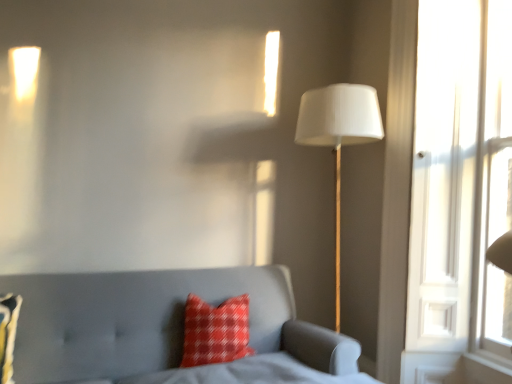
In order to click on red plaid pillow at center, the 1th pillow from the right in this screenshot , I will do `click(215, 331)`.

Locate an element on the screen. This screenshot has height=384, width=512. pillow on the right side of red plaid pillow at lower left, which is counted as the 2th pillow, starting from the back is located at coordinates (215, 331).

Between point (236, 336) and point (9, 352), which one is positioned behind?

The point (236, 336) is farther.

Is red plaid pillow at lower left, placed as the 1th pillow when sorted from front to back, a part of red plaid pillow at center, the 1th pillow when ordered from back to front?

No.

From the image's perspective, which is above, red plaid pillow at center, the second pillow from the front, or red plaid pillow at lower left, which is counted as the 2th pillow, starting from the back?

red plaid pillow at lower left, which is counted as the 2th pillow, starting from the back, appears higher in the image.

Looking at this image, does white fabric lampshade at right appear on the right side of red plaid pillow at lower left, which is the 2th pillow in right-to-left order?

Indeed, white fabric lampshade at right is positioned on the right side of red plaid pillow at lower left, which is the 2th pillow in right-to-left order.

From a real-world perspective, is white fabric lampshade at right physically above red plaid pillow at lower left, which is the 2th pillow in right-to-left order?

Yes, from a real-world perspective, white fabric lampshade at right is above red plaid pillow at lower left, which is the 2th pillow in right-to-left order.

Is white fabric lampshade at right not close to red plaid pillow at lower left, acting as the first pillow starting from the left?

Absolutely, white fabric lampshade at right is distant from red plaid pillow at lower left, acting as the first pillow starting from the left.

From the image's perspective, is white fabric lampshade at right on top of red plaid pillow at lower left, which is the 2th pillow in right-to-left order?

Yes, from the image's perspective, white fabric lampshade at right is on top of red plaid pillow at lower left, which is the 2th pillow in right-to-left order.

Is red plaid pillow at center, the 1th pillow from the right, to the left or to the right of white fabric lampshade at right in the image?

red plaid pillow at center, the 1th pillow from the right, is positioned on white fabric lampshade at right's left side.

Is red plaid pillow at center, the 1th pillow when ordered from back to front, wider than white fabric lampshade at right?

No.

Is point (189, 363) positioned before point (356, 92)?

Yes, point (189, 363) is closer to viewer.

Does red plaid pillow at center, the 1th pillow when ordered from back to front, have a greater height compared to white fabric lampshade at right?

No.

Who is bigger, white fabric lampshade at right or matte gray sofa at lower left?

With larger size is matte gray sofa at lower left.

From the image's perspective, between white fabric lampshade at right and matte gray sofa at lower left, which one is located above?

white fabric lampshade at right appears higher in the image.

From a real-world perspective, is white fabric lampshade at right over matte gray sofa at lower left?

Correct, in the physical world, white fabric lampshade at right is higher than matte gray sofa at lower left.

Is red plaid pillow at center, the 1th pillow from the right, taller or shorter than matte gray sofa at lower left?

red plaid pillow at center, the 1th pillow from the right, is shorter than matte gray sofa at lower left.

From the image's perspective, would you say red plaid pillow at center, the 1th pillow from the right, is positioned over matte gray sofa at lower left?

Indeed, from the image's perspective, red plaid pillow at center, the 1th pillow from the right, is shown above matte gray sofa at lower left.

Can you confirm if red plaid pillow at center, the 1th pillow when ordered from back to front, is wider than matte gray sofa at lower left?

No, red plaid pillow at center, the 1th pillow when ordered from back to front, is not wider than matte gray sofa at lower left.

Is red plaid pillow at lower left, placed as the 1th pillow when sorted from front to back, not near matte gray sofa at lower left?

No, red plaid pillow at lower left, placed as the 1th pillow when sorted from front to back, is not far away from matte gray sofa at lower left.

Which object is more forward, red plaid pillow at lower left, acting as the first pillow starting from the left, or matte gray sofa at lower left?

matte gray sofa at lower left is in front.

Which is behind, point (4, 298) or point (59, 381)?

The point (4, 298) is more distant.

Is matte gray sofa at lower left beside red plaid pillow at lower left, acting as the first pillow starting from the left?

No, matte gray sofa at lower left is not making contact with red plaid pillow at lower left, acting as the first pillow starting from the left.

Based on the photo, considering the sizes of objects matte gray sofa at lower left and red plaid pillow at lower left, placed as the 1th pillow when sorted from front to back, in the image provided, who is wider, matte gray sofa at lower left or red plaid pillow at lower left, placed as the 1th pillow when sorted from front to back,?

matte gray sofa at lower left is wider.

Consider the image. Could you tell me if matte gray sofa at lower left is turned towards red plaid pillow at lower left, acting as the first pillow starting from the left?

No, matte gray sofa at lower left is not facing towards red plaid pillow at lower left, acting as the first pillow starting from the left.

Based on their sizes in the image, would you say matte gray sofa at lower left is bigger or smaller than red plaid pillow at lower left, placed as the 1th pillow when sorted from front to back?

matte gray sofa at lower left is bigger than red plaid pillow at lower left, placed as the 1th pillow when sorted from front to back.

Identify the location of pillow above the red plaid pillow at center, the second pillow from the front (from the image's perspective). (8, 334).

Image resolution: width=512 pixels, height=384 pixels. What are the coordinates of `the 2nd pillow below the white fabric lampshade at right (from a real-world perspective)` in the screenshot? It's located at (8, 334).

When comparing their distances from red plaid pillow at lower left, placed as the 1th pillow when sorted from front to back, does matte gray sofa at lower left or red plaid pillow at center, acting as the second pillow starting from the left, seem closer?

The object closer to red plaid pillow at lower left, placed as the 1th pillow when sorted from front to back, is matte gray sofa at lower left.

Considering their positions, is red plaid pillow at center, the 1th pillow from the right, positioned further to matte gray sofa at lower left than white fabric lampshade at right?

white fabric lampshade at right lies further to matte gray sofa at lower left than the other object.

Which object lies nearer to the anchor point red plaid pillow at center, acting as the second pillow starting from the left, red plaid pillow at lower left, acting as the first pillow starting from the left, or matte gray sofa at lower left?

matte gray sofa at lower left is positioned closer to the anchor red plaid pillow at center, acting as the second pillow starting from the left.

Considering their positions, is red plaid pillow at center, acting as the second pillow starting from the left, positioned further to red plaid pillow at lower left, placed as the 1th pillow when sorted from front to back, than white fabric lampshade at right?

white fabric lampshade at right lies further to red plaid pillow at lower left, placed as the 1th pillow when sorted from front to back, than the other object.

Considering their positions, is matte gray sofa at lower left positioned closer to white fabric lampshade at right than red plaid pillow at center, the second pillow from the front?

Among the two, red plaid pillow at center, the second pillow from the front, is located nearer to white fabric lampshade at right.

Looking at the image, which one is located further to white fabric lampshade at right, red plaid pillow at center, the 1th pillow when ordered from back to front, or matte gray sofa at lower left?

Based on the image, matte gray sofa at lower left appears to be further to white fabric lampshade at right.

From the image, which object appears to be nearer to matte gray sofa at lower left, white fabric lampshade at right or red plaid pillow at center, the second pillow from the front?

red plaid pillow at center, the second pillow from the front, is closer to matte gray sofa at lower left.

Looking at the image, which one is located closer to white fabric lampshade at right, red plaid pillow at center, acting as the second pillow starting from the left, or red plaid pillow at lower left, placed as the 1th pillow when sorted from front to back?

The object closer to white fabric lampshade at right is red plaid pillow at center, acting as the second pillow starting from the left.

Find the location of a particular element. Image resolution: width=512 pixels, height=384 pixels. pillow between red plaid pillow at lower left, acting as the first pillow starting from the left, and white fabric lampshade at right is located at coordinates (215, 331).

Where is `furniture situated between red plaid pillow at lower left, placed as the 1th pillow when sorted from front to back, and red plaid pillow at center, acting as the second pillow starting from the left, from left to right`? Image resolution: width=512 pixels, height=384 pixels. furniture situated between red plaid pillow at lower left, placed as the 1th pillow when sorted from front to back, and red plaid pillow at center, acting as the second pillow starting from the left, from left to right is located at coordinates (155, 323).

Find the location of a particular element. furniture situated between red plaid pillow at lower left, which is the 2th pillow in right-to-left order, and white fabric lampshade at right from left to right is located at coordinates (155, 323).